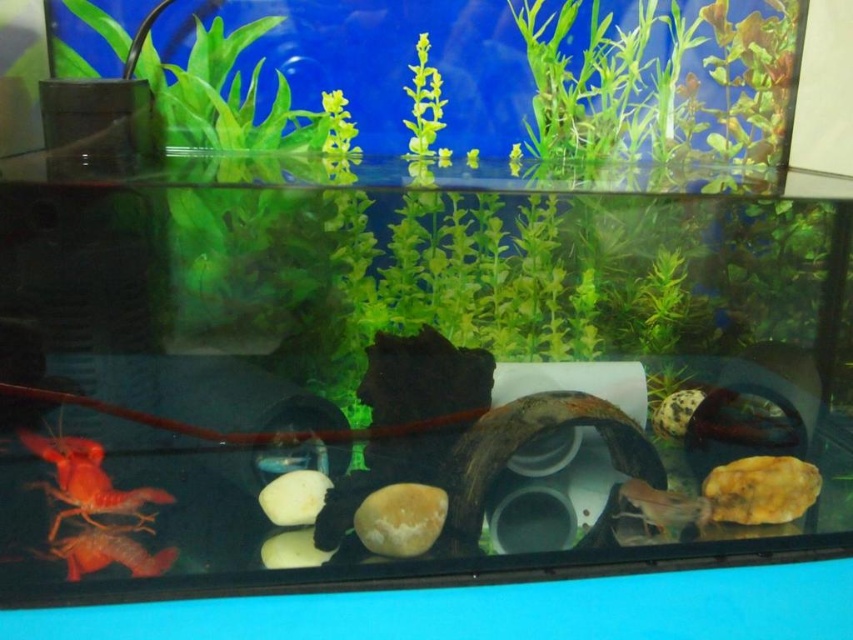
You are a new fish in the aquarium and want to swim to the green matte plant at upper center. Based on its coordinates, can you estimate its position relative to the center of the tank?

The green matte plant at upper center is located at point coordinates approximately 0.167 on the x axis and 0.218 on the y axis. This places it slightly to the left and above the center of the tank.

You are an underwater explorer looking at the aquarium. There are two points marked in the tank. The first point is at coordinates point (219, 100) and the second is at point (103, 545). If you swim towards the second point, will you pass the first point before reaching it?

Point (219, 100) is behind point (103, 545), so if you swim towards the second point, you will not pass the first point before reaching it because the first point is located behind the second point from your perspective.

You are an aquatic plant enthusiast observing the aquarium. You notice the green matte plant at upper center and the matte orange shrimp at lower left. Which object is bigger in size?

The green matte plant at upper center is larger in size compared to the matte orange shrimp at lower left.